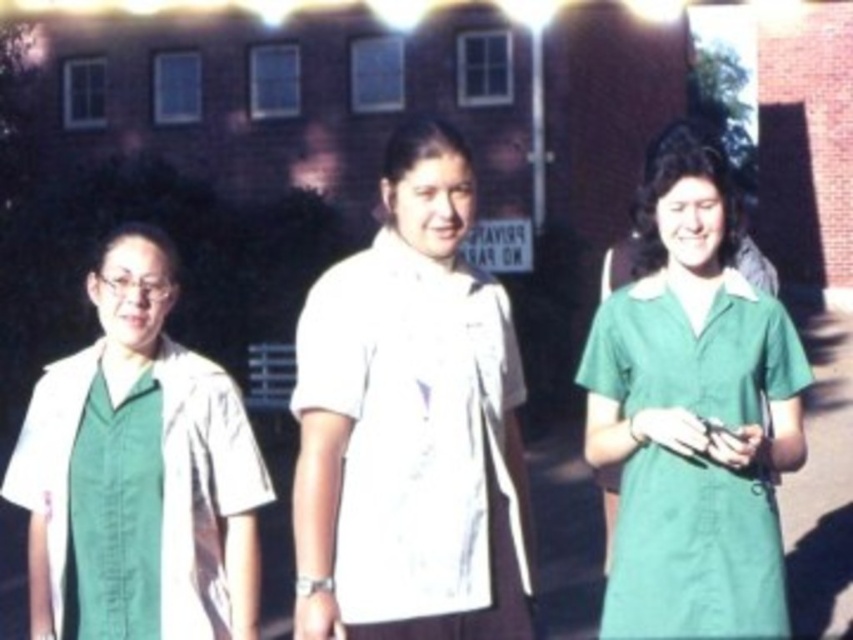
You are a photographer setting up for a group photo. You need to ensure all subjects are visible. Given that the green fabric shirt at center and the white cotton shirt at center are both at the center, which one might block the view of the other?

The green fabric shirt at center is larger in size than the white cotton shirt at center, so it might block the view of the white cotton shirt at center.

You are a photographer trying to capture a clear photo of the green fabric dress at center and the green fabric shirt at center. Which one will appear larger in the photo?

The green fabric dress at center will appear larger in the photo because it is closer to the viewer than the green fabric shirt at center.